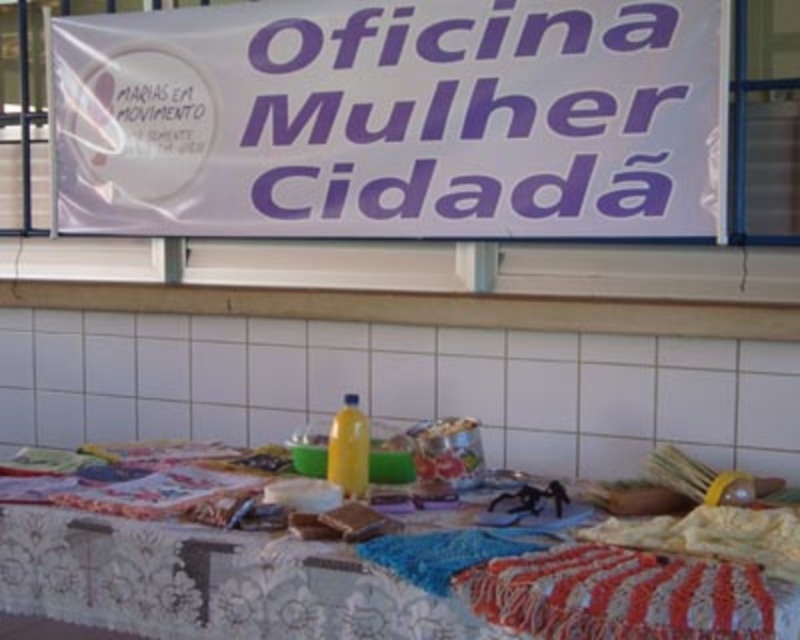
Question: Does textured fabric tablecloth at center appear over striped crochet blanket at lower right?

Choices:
 (A) no
 (B) yes

Answer: (A)

Question: Can you confirm if white paper banner at upper center is smaller than striped crochet blanket at lower right?

Choices:
 (A) no
 (B) yes

Answer: (A)

Question: Which point is closer to the camera taking this photo?

Choices:
 (A) (128, 88)
 (B) (698, 616)
 (C) (421, 605)

Answer: (B)

Question: Can you confirm if white paper banner at upper center is thinner than striped crochet blanket at lower right?

Choices:
 (A) no
 (B) yes

Answer: (A)

Question: Which point is closer to the camera?

Choices:
 (A) white paper banner at upper center
 (B) textured fabric tablecloth at center
 (C) striped crochet blanket at lower right

Answer: (C)

Question: Estimate the real-world distances between objects in this image. Which object is closer to the white paper banner at upper center?

Choices:
 (A) textured fabric tablecloth at center
 (B) striped crochet blanket at lower right

Answer: (A)